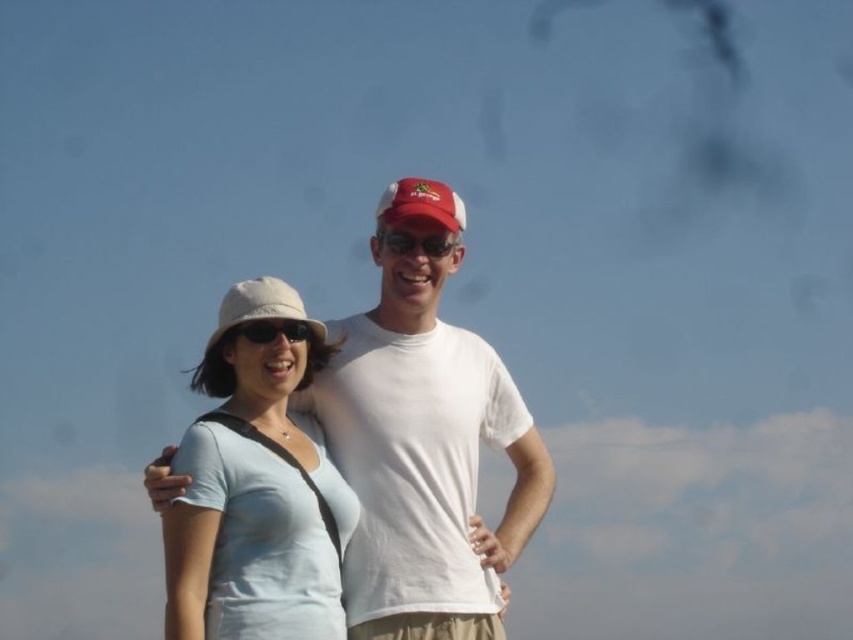
Question: Is light blue fabric shirt at center positioned in front of matte black sunglasses at center?

Choices:
 (A) no
 (B) yes

Answer: (B)

Question: Among these objects, which one is nearest to the camera?

Choices:
 (A) light blue fabric shirt at center
 (B) matte black sunglasses at center
 (C) beige fabric baseball hat at center

Answer: (A)

Question: Among these objects, which one is nearest to the camera?

Choices:
 (A) matte black sunglasses at center
 (B) light blue cotton shirt at center
 (C) matte plastic sunglasses at center

Answer: (B)

Question: Is light blue fabric shirt at center smaller than matte black sunglasses at center?

Choices:
 (A) no
 (B) yes

Answer: (A)

Question: Among these points, which one is farthest from the camera?

Choices:
 (A) (332, 385)
 (B) (218, 340)

Answer: (A)

Question: Is light blue fabric shirt at center below beige fabric baseball hat at center?

Choices:
 (A) no
 (B) yes

Answer: (B)